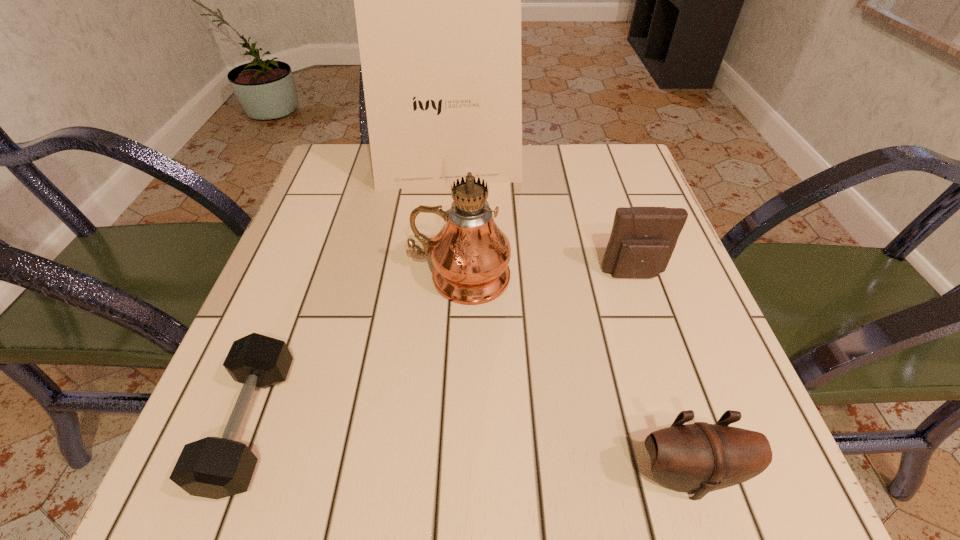
Where is `free space between the shopping bag and the nearer pouch`? Image resolution: width=960 pixels, height=540 pixels. free space between the shopping bag and the nearer pouch is located at coordinates (567, 322).

Identify the location of vacant area that lies between the dumbbell and the farthest object. This screenshot has width=960, height=540. (349, 296).

You are a GUI agent. You are given a task and a screenshot of the screen. Output one action in this format:
    pyautogui.click(x=<x>, y=<y>)
    Task: Click on the vacant space in between the fourth tallest object and the shopping bag
    The width and height of the screenshot is (960, 540).
    Given the screenshot: What is the action you would take?
    pyautogui.click(x=567, y=322)

Identify which object is located as the fourth nearest to the dumbbell. Please provide its 2D coordinates. Your answer should be formatted as a tuple, i.e. [(x, y)], where the tuple contains the x and y coordinates of a point satisfying the conditions above.

[(642, 240)]

Identify which object is located as the nearest to the third shortest object. Please provide its 2D coordinates. Your answer should be formatted as a tuple, i.e. [(x, y)], where the tuple contains the x and y coordinates of a point satisfying the conditions above.

[(470, 254)]